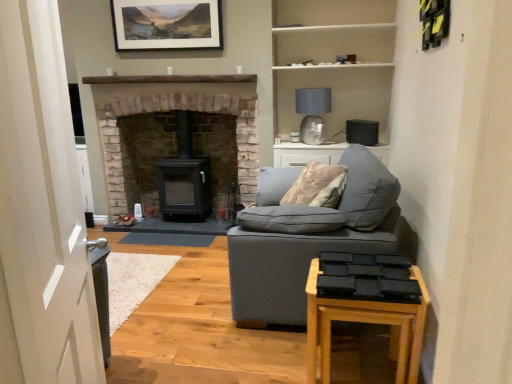
Question: Considering the relative positions of brick fireplace at center and white matte shelves at upper center in the image provided, is brick fireplace at center to the left or to the right of white matte shelves at upper center?

Choices:
 (A) left
 (B) right

Answer: (A)

Question: Looking at the image, does brick fireplace at center seem bigger or smaller compared to white matte shelves at upper center?

Choices:
 (A) small
 (B) big

Answer: (B)

Question: Which object is the farthest from the black matte wood burning stove at center?

Choices:
 (A) white matte shelves at upper center
 (B) matte gray fabric couch at center
 (C) white glossy door at left
 (D) soft gray fabric couch at center
 (E) matte glass lampshade at upper center

Answer: (C)

Question: Which is farther from the black matte wood burning stove at center?

Choices:
 (A) matte gray fabric couch at center
 (B) matte glass lampshade at upper center
 (C) matte wooden picture frame at upper center
 (D) white glossy door at left
 (E) wooden side table at lower right

Answer: (D)